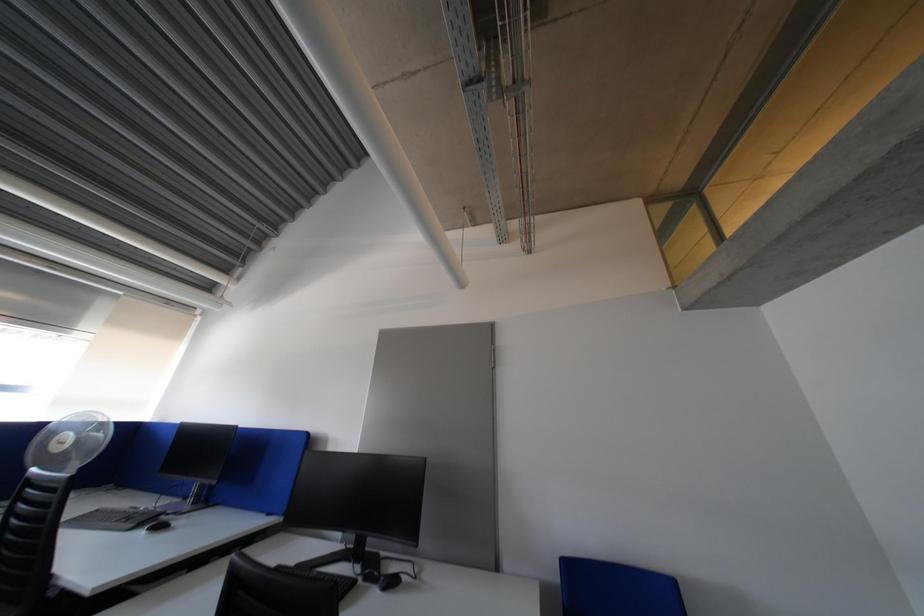
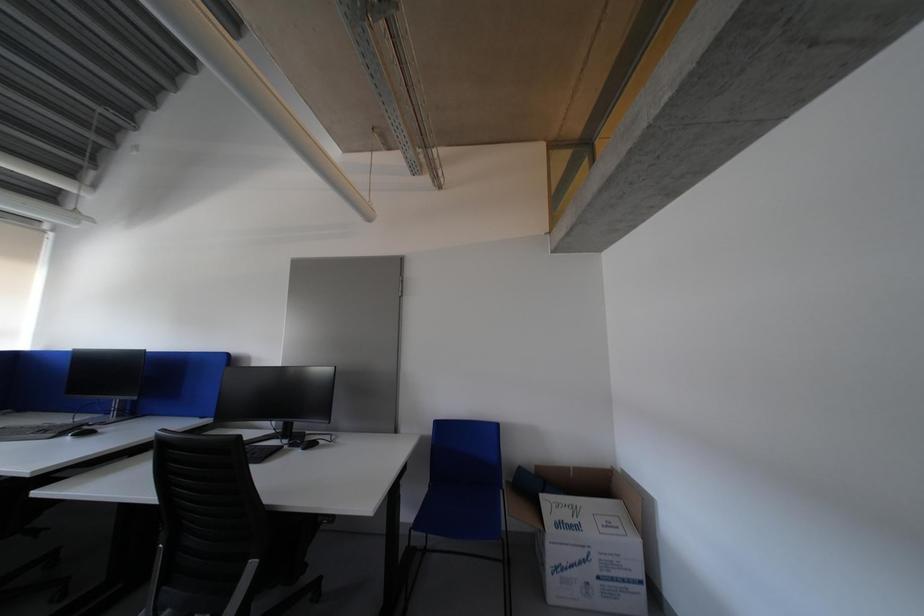
What movement of the cameraman would produce the second image?

The cameraman moved toward right, backward.